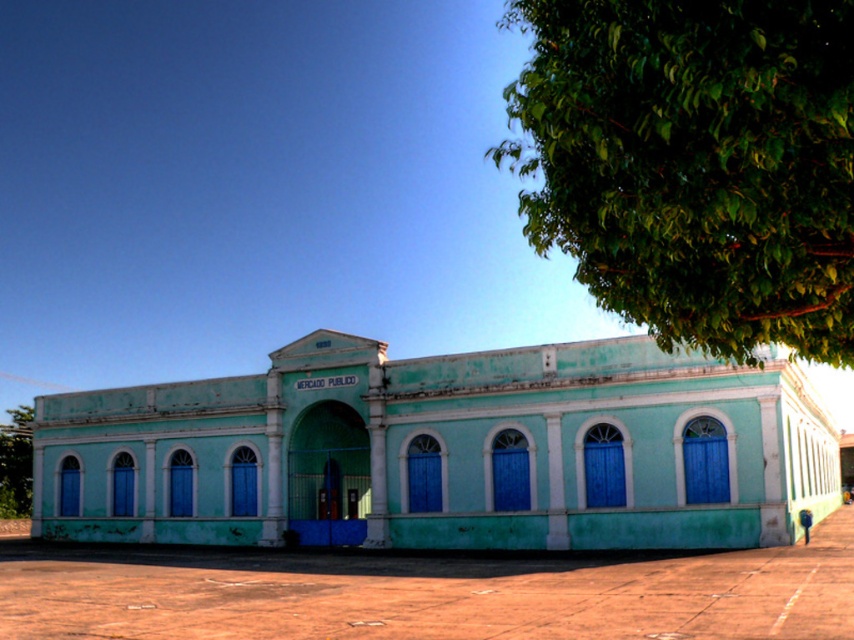
Looking at the historic teal building with its central entrance, where would you see the green leafy tree at upper right in relation to the green leafy tree at lower left?

The green leafy tree at upper right is to the right of the green leafy tree at lower left.

You are a photographer planning to take a symmetrical photo of the historic teal building. You notice two green leafy trees in the scene. Which tree has a smaller width, the green leafy tree at upper right or the green leafy tree at lower left?

The green leafy tree at upper right has a smaller width than the green leafy tree at lower left.

You are standing in front of the historic teal building and want to determine the relative positions of two points marked on its facade. Which point, point (695, 164) or point (27, 445), is closer to you?

Point (695, 164) is closer to the viewer than point (27, 445).